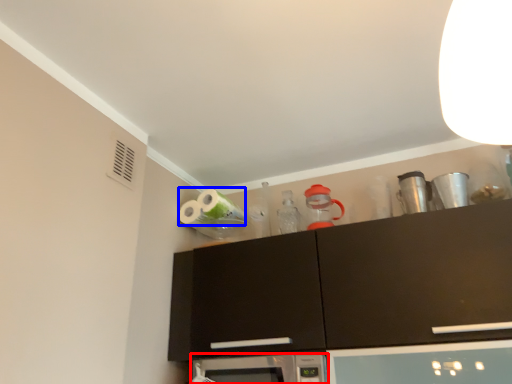
Question: Which object appears closest to the camera in this image, microwave oven (highlighted by a red box) or toilet paper (highlighted by a blue box)?

Choices:
 (A) microwave oven
 (B) toilet paper

Answer: (A)